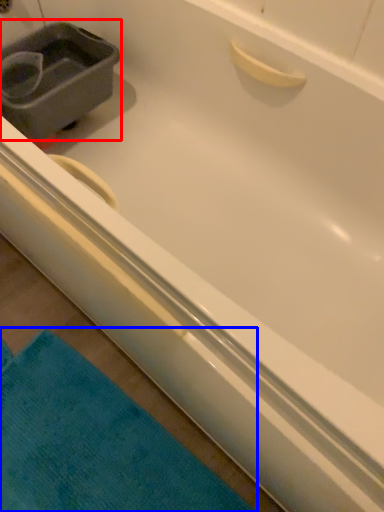
Question: Which object is closer to the camera taking this photo, sink (highlighted by a red box) or bath towel (highlighted by a blue box)?

Choices:
 (A) sink
 (B) bath towel

Answer: (B)